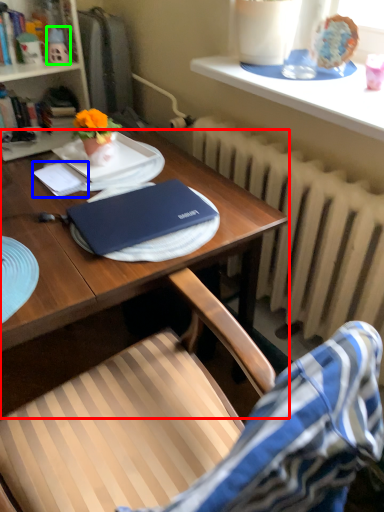
Question: Which is farther away from desk (highlighted by a red box)? notepad (highlighted by a blue box) or toy (highlighted by a green box)?

Choices:
 (A) notepad
 (B) toy

Answer: (B)